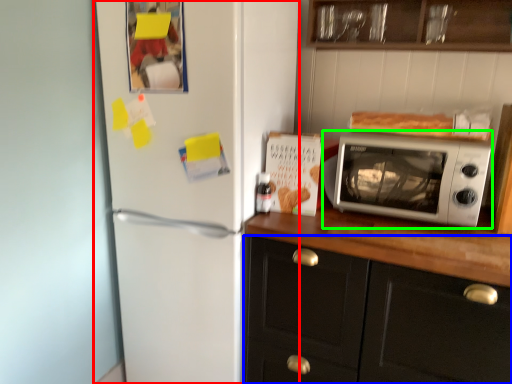
Question: Considering the real-world distances, which object is closest to refrigerator (highlighted by a red box)? cabinetry (highlighted by a blue box) or microwave oven (highlighted by a green box).

Choices:
 (A) cabinetry
 (B) microwave oven

Answer: (A)